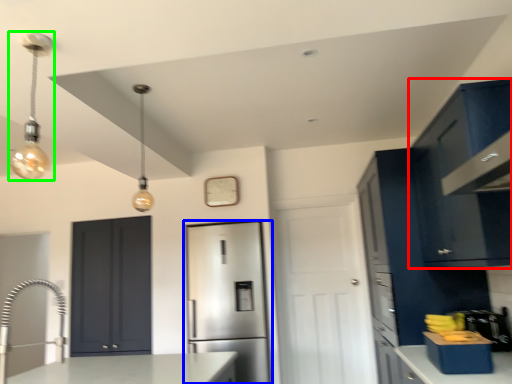
Question: Which is farther away from cabinetry (highlighted by a red box)? refrigerator (highlighted by a blue box) or light fixture (highlighted by a green box)?

Choices:
 (A) refrigerator
 (B) light fixture

Answer: (A)